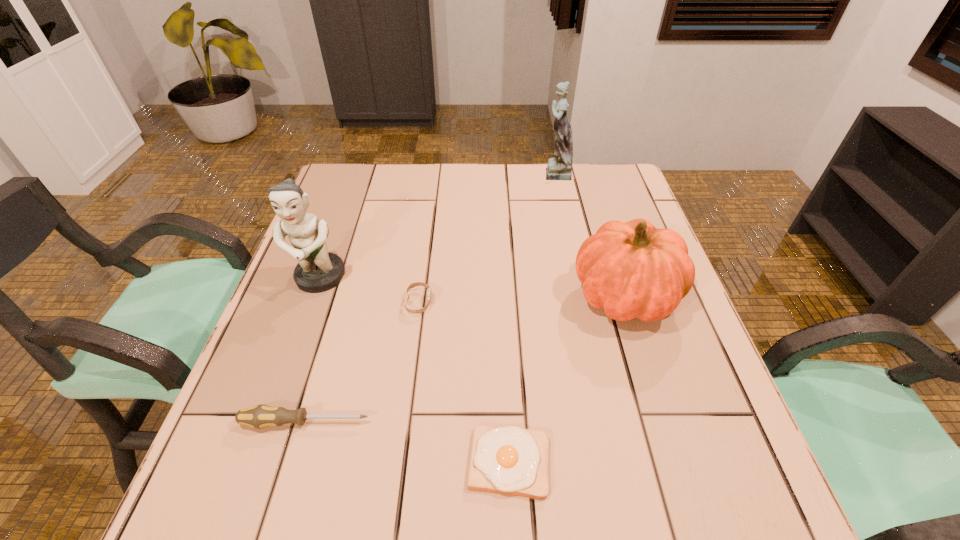
Locate an element on the screen. This screenshot has width=960, height=540. free space located on the front-facing side of the farthest object is located at coordinates (501, 172).

Where is `vacant region located 0.150m on the front-facing side of the nearer figurine`? vacant region located 0.150m on the front-facing side of the nearer figurine is located at coordinates (293, 354).

Locate an element on the screen. This screenshot has height=540, width=960. free space located 0.170m on the back of the pumpkin is located at coordinates (600, 218).

This screenshot has width=960, height=540. What are the coordinates of `free space located at the tip of the screwdriver` in the screenshot? It's located at (491, 422).

Locate an element on the screen. This screenshot has width=960, height=540. vacant space positioned 0.180m on the face of the watch is located at coordinates (510, 302).

Find the location of a particular element. The width and height of the screenshot is (960, 540). free spot located on the left of the shortest object is located at coordinates (350, 462).

This screenshot has height=540, width=960. In order to click on object at the far edge in this screenshot , I will do `click(560, 167)`.

The image size is (960, 540). Identify the location of object situated at the near edge. (511, 460).

The height and width of the screenshot is (540, 960). Identify the location of figurine that is at the left edge. (318, 270).

Locate an element on the screen. This screenshot has width=960, height=540. screwdriver that is positioned at the left edge is located at coordinates (260, 416).